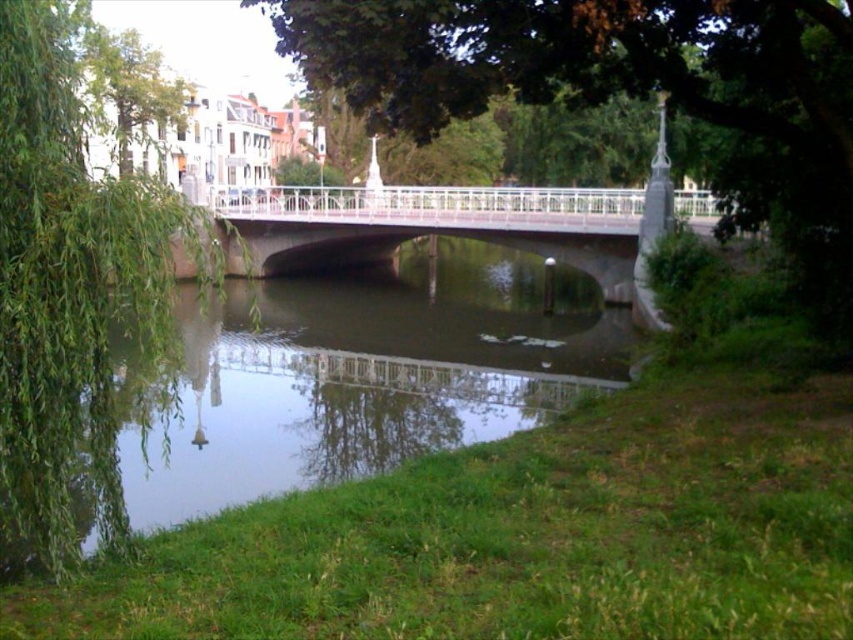
Can you confirm if green grassy river at center is positioned above green leafy tree at upper left?

Incorrect, green grassy river at center is not positioned above green leafy tree at upper left.

From the picture: Between green grassy river at center and green leafy tree at upper left, which one appears on the left side from the viewer's perspective?

From the viewer's perspective, green leafy tree at upper left appears more on the left side.

Which is behind, point (440, 368) or point (128, 67)?

Point (128, 67)

Image resolution: width=853 pixels, height=640 pixels. What are the coordinates of `green grassy river at center` in the screenshot? It's located at (346, 380).

Between point (26, 20) and point (97, 40), which one is positioned in front?

Point (26, 20)

Who is more distant from viewer, (10, 426) or (164, 93)?

Positioned behind is point (164, 93).

Image resolution: width=853 pixels, height=640 pixels. I want to click on green leafy willow at left, so click(71, 298).

Is green grassy river at center positioned at the back of white metallic bridge at center?

No, green grassy river at center is in front of white metallic bridge at center.

Does green grassy river at center appear over white metallic bridge at center?

Actually, green grassy river at center is below white metallic bridge at center.

The image size is (853, 640). In order to click on green grassy river at center in this screenshot , I will do `click(346, 380)`.